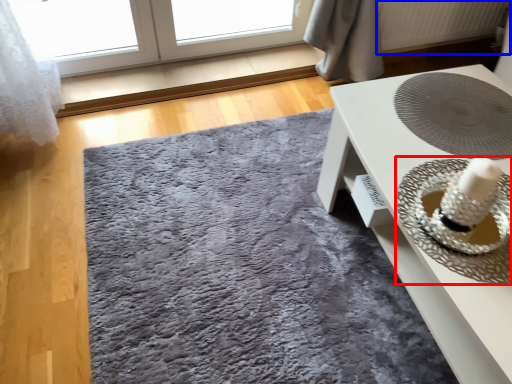
Question: Which of the following is the closest to the observer, straw hat (highlighted by a red box) or radiator (highlighted by a blue box)?

Choices:
 (A) straw hat
 (B) radiator

Answer: (A)